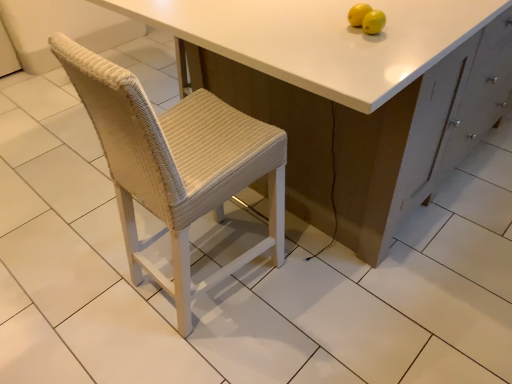
Find the location of `vacant space in front of yellow matte lemons at upper right`. vacant space in front of yellow matte lemons at upper right is located at coordinates (370, 57).